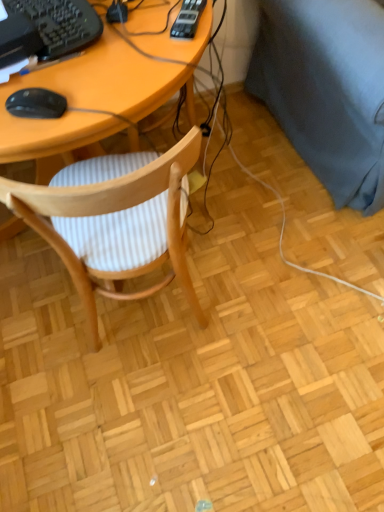
At what (x,y) coordinates should I click in order to perform the action: click on vacant region under wooden chair with striped cushion at center (from a real-world perspective). Please return your answer as a coordinate pair (x, y). Looking at the image, I should click on (151, 327).